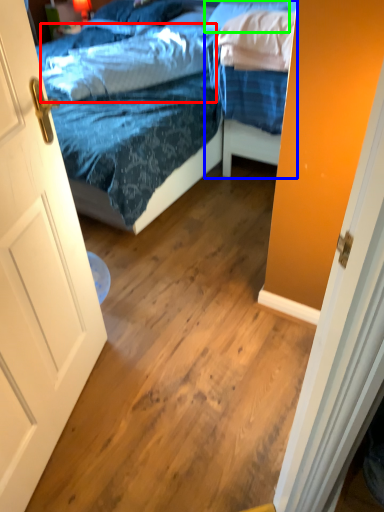
Question: Estimate the real-world distances between objects in this image. Which object is closer to pillow (highlighted by a red box), bed (highlighted by a blue box) or pillow (highlighted by a green box)?

Choices:
 (A) bed
 (B) pillow

Answer: (A)